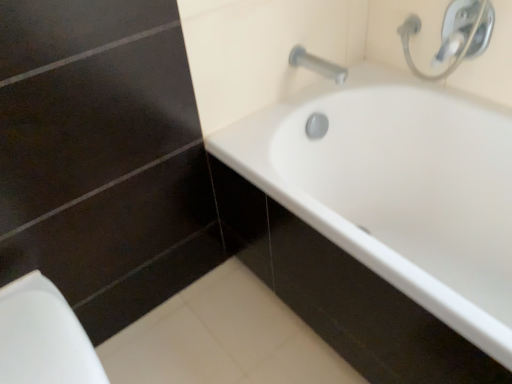
I want to click on silver metallic tap at upper right, so click(x=317, y=65).

Between point (44, 314) and point (310, 64), which one is positioned in front?

The point (44, 314) is more forward.

Who is smaller, white glossy porcelain at lower left or silver metallic tap at upper right?

With smaller size is silver metallic tap at upper right.

From the picture: From a real-world perspective, who is located higher, white glossy porcelain at lower left or silver metallic tap at upper right?

silver metallic tap at upper right is physically above.

Between silver metallic tap at upper right and white glossy bathtub at center, which one has larger width?

Wider between the two is white glossy bathtub at center.

Is white glossy bathtub at center inside silver metallic tap at upper right?

No.

Is silver metallic tap at upper right directly adjacent to white glossy bathtub at center?

No.

Considering the relative sizes of white glossy bathtub at center and white glossy porcelain at lower left in the image provided, is white glossy bathtub at center bigger than white glossy porcelain at lower left?

Indeed, white glossy bathtub at center has a larger size compared to white glossy porcelain at lower left.

Between white glossy bathtub at center and white glossy porcelain at lower left, which one has more height?

white glossy bathtub at center.

Considering the sizes of objects white glossy bathtub at center and white glossy porcelain at lower left in the image provided, who is wider, white glossy bathtub at center or white glossy porcelain at lower left?

With larger width is white glossy bathtub at center.

How much distance is there between white glossy bathtub at center and white glossy porcelain at lower left?

81.43 centimeters.

Is silver metallic faucet at upper right next to white glossy porcelain at lower left and touching it?

silver metallic faucet at upper right is not next to white glossy porcelain at lower left, and they're not touching.

Does silver metallic faucet at upper right have a smaller size compared to white glossy porcelain at lower left?

Yes.

Is silver metallic faucet at upper right taller than white glossy porcelain at lower left?

Incorrect, the height of silver metallic faucet at upper right is not larger of that of white glossy porcelain at lower left.

What's the angular difference between silver metallic faucet at upper right and white glossy porcelain at lower left's facing directions?

silver metallic faucet at upper right and white glossy porcelain at lower left are facing 89.7 degrees away from each other.

Between silver metallic tap at upper right and silver metallic faucet at upper right, which one has smaller size?

silver metallic tap at upper right.

Which object is thinner, silver metallic tap at upper right or silver metallic faucet at upper right?

Thinner between the two is silver metallic faucet at upper right.

Who is shorter, silver metallic tap at upper right or silver metallic faucet at upper right?

Standing shorter between the two is silver metallic tap at upper right.

From the image's perspective, does silver metallic tap at upper right appear lower than silver metallic faucet at upper right?

Yes, from the image's perspective, silver metallic tap at upper right is below silver metallic faucet at upper right.

In terms of height, does white glossy porcelain at lower left look taller or shorter compared to silver metallic faucet at upper right?

Considering their sizes, white glossy porcelain at lower left has more height than silver metallic faucet at upper right.

Considering the relative positions of white glossy porcelain at lower left and silver metallic faucet at upper right in the image provided, is white glossy porcelain at lower left in front of silver metallic faucet at upper right?

Yes.

Is white glossy porcelain at lower left looking in the opposite direction of silver metallic faucet at upper right?

No, silver metallic faucet at upper right is not at the back of white glossy porcelain at lower left.

Does white glossy porcelain at lower left appear on the right side of silver metallic faucet at upper right?

No, white glossy porcelain at lower left is not to the right of silver metallic faucet at upper right.

Which is more to the left, white glossy bathtub at center or silver metallic faucet at upper right?

Positioned to the left is white glossy bathtub at center.

Are white glossy bathtub at center and silver metallic faucet at upper right beside each other?

white glossy bathtub at center and silver metallic faucet at upper right are not in contact.

How much distance is there between white glossy bathtub at center and silver metallic faucet at upper right?

36.31 centimeters.

I want to click on plumbing fixture located above the white glossy bathtub at center (from a real-world perspective), so click(454, 34).

The width and height of the screenshot is (512, 384). What are the coordinates of `porcelain that is on the left side of silver metallic tap at upper right` in the screenshot? It's located at (42, 337).

Image resolution: width=512 pixels, height=384 pixels. I want to click on tap that is above the white glossy bathtub at center (from the image's perspective), so click(317, 65).

From the picture: Estimate the real-world distances between objects in this image. Which object is closer to white glossy bathtub at center, silver metallic faucet at upper right or white glossy porcelain at lower left?

silver metallic faucet at upper right is positioned closer to the anchor white glossy bathtub at center.

Looking at the image, which one is located further to white glossy bathtub at center, silver metallic tap at upper right or silver metallic faucet at upper right?

The object further to white glossy bathtub at center is silver metallic tap at upper right.

Based on their spatial positions, is silver metallic faucet at upper right or silver metallic tap at upper right further from white glossy bathtub at center?

silver metallic tap at upper right is positioned further to the anchor white glossy bathtub at center.

Consider the image. From the image, which object appears to be farther from silver metallic faucet at upper right, white glossy bathtub at center or white glossy porcelain at lower left?

Based on the image, white glossy porcelain at lower left appears to be further to silver metallic faucet at upper right.

Looking at this image, considering their positions, is white glossy bathtub at center positioned further to silver metallic faucet at upper right than silver metallic tap at upper right?

Based on the image, white glossy bathtub at center appears to be further to silver metallic faucet at upper right.

Looking at this image, based on their spatial positions, is white glossy porcelain at lower left or silver metallic faucet at upper right further from white glossy bathtub at center?

white glossy porcelain at lower left.

Considering their positions, is white glossy porcelain at lower left positioned further to silver metallic tap at upper right than silver metallic faucet at upper right?

white glossy porcelain at lower left is positioned further to the anchor silver metallic tap at upper right.

Based on their spatial positions, is silver metallic tap at upper right or white glossy porcelain at lower left further from white glossy bathtub at center?

The object further to white glossy bathtub at center is white glossy porcelain at lower left.

Where is `bathtub between white glossy porcelain at lower left and silver metallic faucet at upper right in the horizontal direction`? bathtub between white glossy porcelain at lower left and silver metallic faucet at upper right in the horizontal direction is located at coordinates (398, 189).

Where is `tap between white glossy porcelain at lower left and silver metallic faucet at upper right in the horizontal direction`? The image size is (512, 384). tap between white glossy porcelain at lower left and silver metallic faucet at upper right in the horizontal direction is located at coordinates (317, 65).

I want to click on tap between white glossy porcelain at lower left and white glossy bathtub at center in the horizontal direction, so click(317, 65).

Where is `tap between silver metallic faucet at upper right and white glossy bathtub at center from top to bottom`? This screenshot has width=512, height=384. tap between silver metallic faucet at upper right and white glossy bathtub at center from top to bottom is located at coordinates (317, 65).